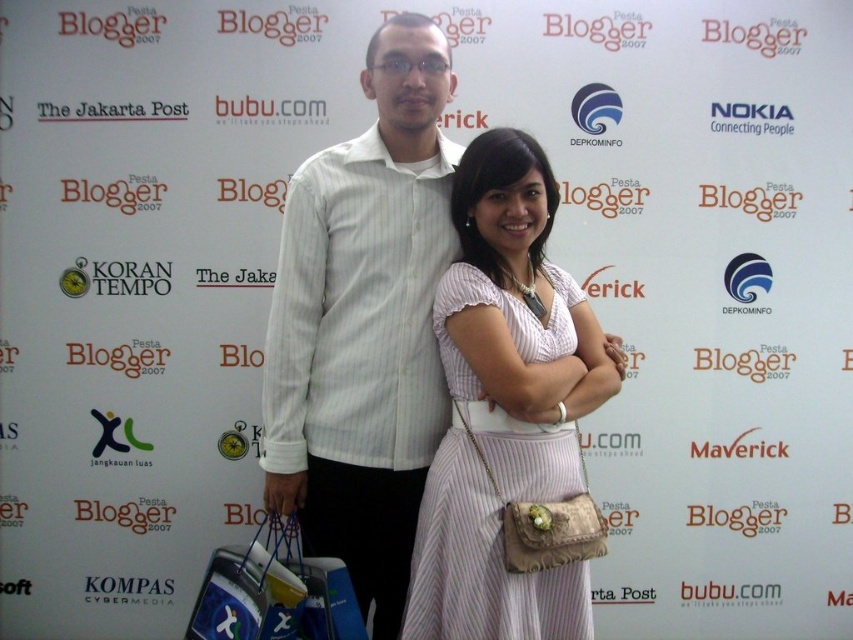
Based on the photo, who is taller, white striped shirt at center or blue fabric shopping bag at lower left?

Standing taller between the two is white striped shirt at center.

Does white striped shirt at center have a greater height compared to blue fabric shopping bag at lower left?

Indeed, white striped shirt at center has a greater height compared to blue fabric shopping bag at lower left.

At what (x,y) coordinates should I click in order to perform the action: click on white striped shirt at center. Please return your answer as a coordinate pair (x, y). Looking at the image, I should click on (364, 323).

You are a GUI agent. You are given a task and a screenshot of the screen. Output one action in this format:
    pyautogui.click(x=<x>, y=<y>)
    Task: Click on the white striped shirt at center
    
    Given the screenshot: What is the action you would take?
    pyautogui.click(x=364, y=323)

Who is lower down, white striped shirt at center or white striped dress at center?

white striped dress at center

Between point (416, 499) and point (422, 604), which one is positioned behind?

Point (416, 499)

Is point (380, 333) less distant than point (579, 593)?

No, it is not.

The width and height of the screenshot is (853, 640). Find the location of `white striped shirt at center`. white striped shirt at center is located at coordinates click(x=364, y=323).

Is white striped dress at center further to the viewer compared to blue fabric shopping bag at lower left?

No.

Is white striped dress at center to the left of blue fabric shopping bag at lower left from the viewer's perspective?

In fact, white striped dress at center is to the right of blue fabric shopping bag at lower left.

Image resolution: width=853 pixels, height=640 pixels. What do you see at coordinates (495, 484) in the screenshot?
I see `white striped dress at center` at bounding box center [495, 484].

This screenshot has width=853, height=640. In order to click on white striped dress at center in this screenshot , I will do `click(495, 484)`.